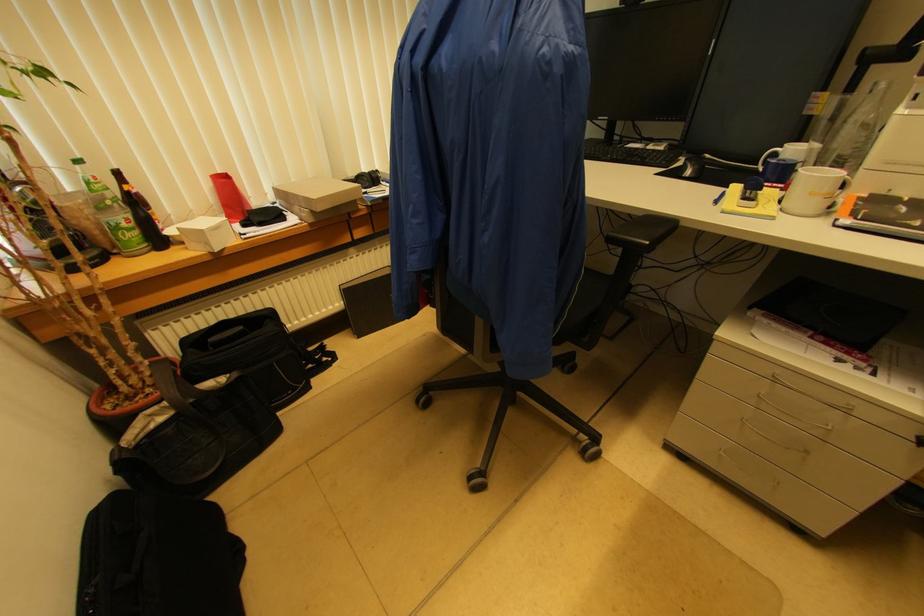
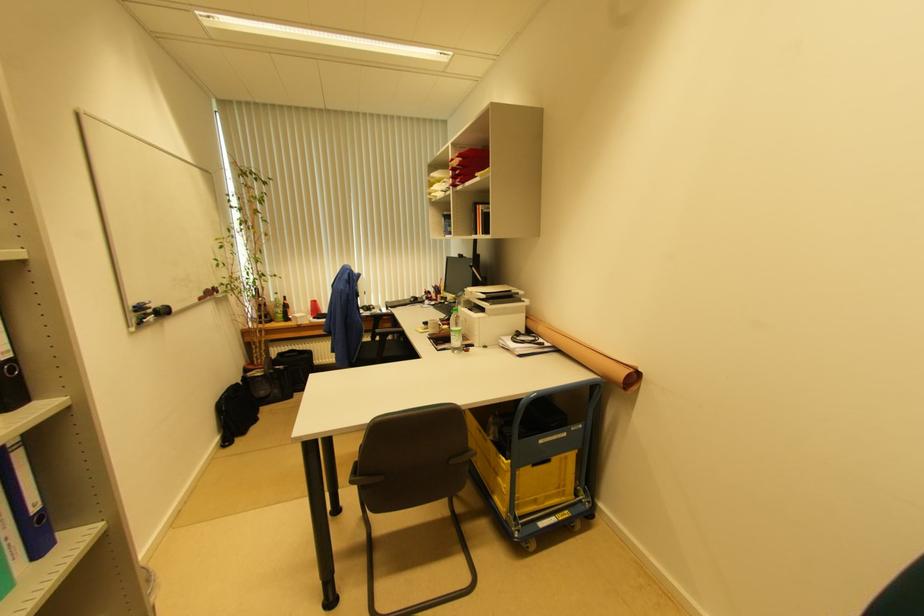
Where in the second image is the point corresponding to [117,475] from the first image?

(242, 383)